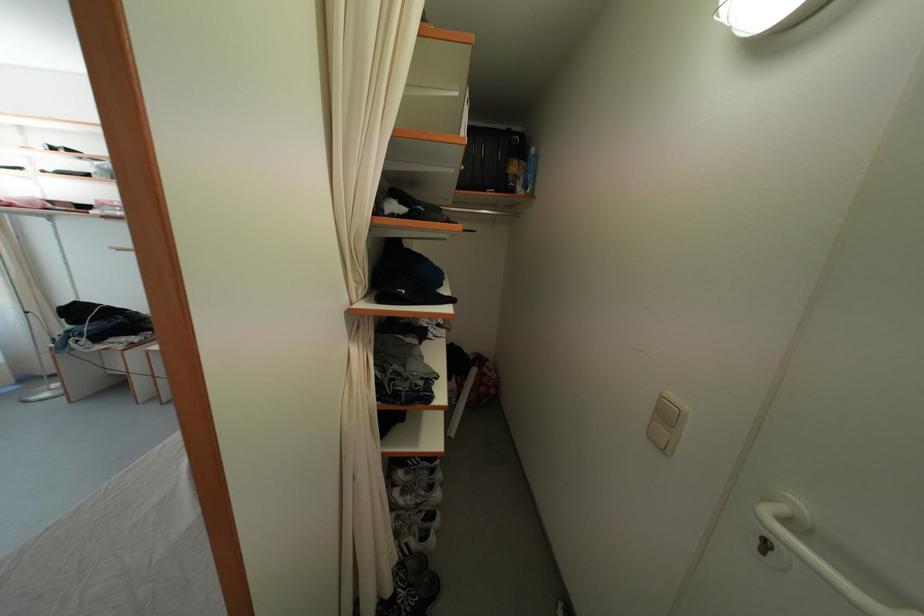
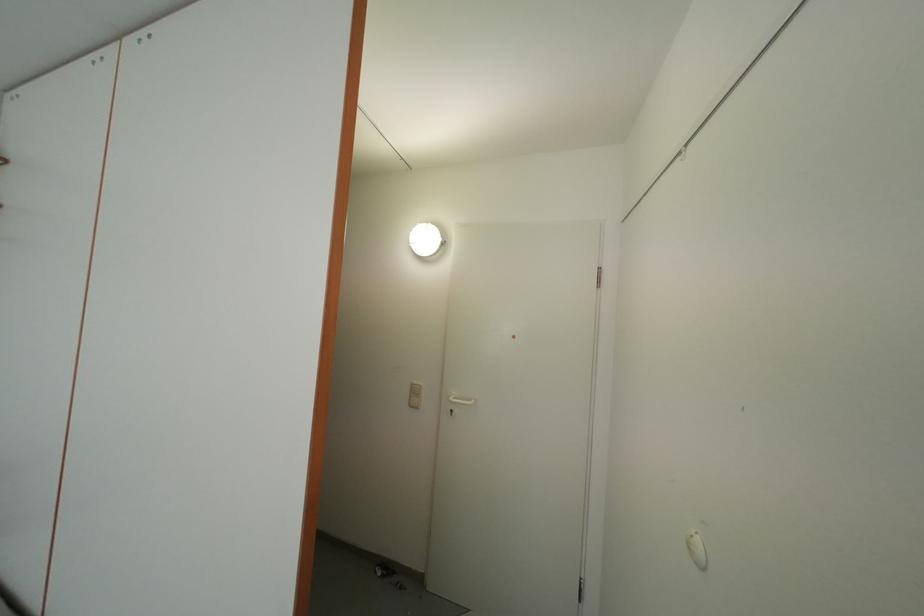
Question: The images are taken continuously from a first-person perspective. In which direction is your viewpoint rotating?

Choices:
 (A) Left
 (B) Right
 (C) Up
 (D) Down

Answer: (B)